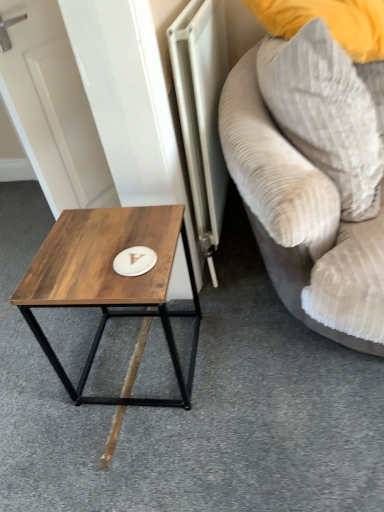
Question: In terms of width, does wooden table at left look wider or thinner when compared to gray corduroy pillow at upper right?

Choices:
 (A) thin
 (B) wide

Answer: (B)

Question: From the image's perspective, is wooden table at left located above or below gray corduroy pillow at upper right?

Choices:
 (A) below
 (B) above

Answer: (A)

Question: Based on their relative distances, which object is farther from the metallic silver radiator at center?

Choices:
 (A) velvet beige couch at right
 (B) gray corduroy pillow at upper right
 (C) wooden table at left

Answer: (C)

Question: Estimate the real-world distances between objects in this image. Which object is closer to the wooden table at left?

Choices:
 (A) metallic silver radiator at center
 (B) gray corduroy pillow at upper right
 (C) velvet beige couch at right

Answer: (A)